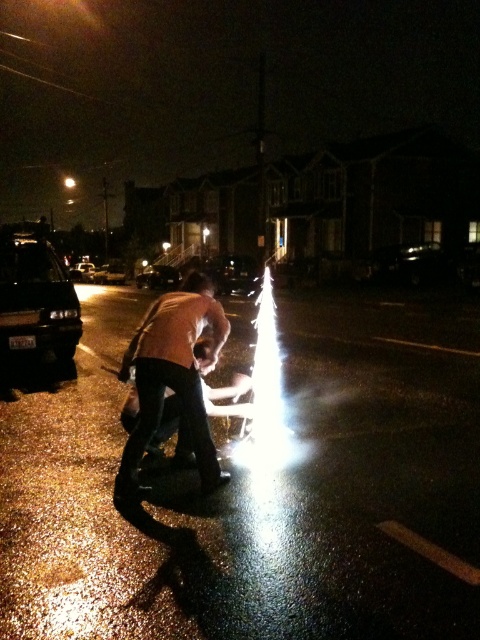
Between black glossy car at upper right and shiny silver car at center, which one has more height?

Standing taller between the two is shiny silver car at center.

Who is shorter, black glossy car at upper right or shiny silver car at center?

black glossy car at upper right is shorter.

Between point (383, 282) and point (235, 275), which one is positioned behind?

Point (235, 275)

I want to click on black glossy car at upper right, so click(408, 262).

Is point (43, 289) behind point (236, 257)?

No, (43, 289) is in front of (236, 257).

Between matte black car at left and shiny silver car at center, which one has more height?

Standing taller between the two is shiny silver car at center.

In order to click on matte black car at left in this screenshot , I will do `click(36, 301)`.

Identify the location of matte black car at left. The width and height of the screenshot is (480, 640). (36, 301).

Does point (233, 259) come behind point (162, 266)?

No, it is not.

Identify the location of shiny silver car at center. (233, 275).